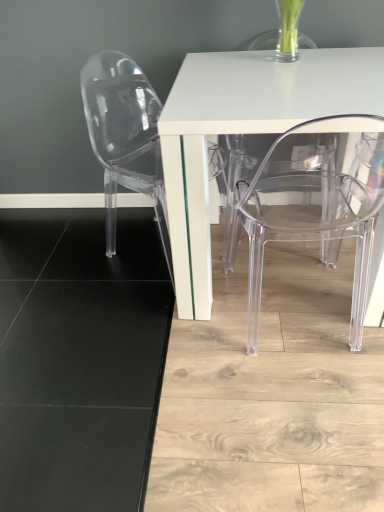
The width and height of the screenshot is (384, 512). I want to click on free space that is to the left of transparent plastic chair at left, the first chair from the left, so click(x=74, y=264).